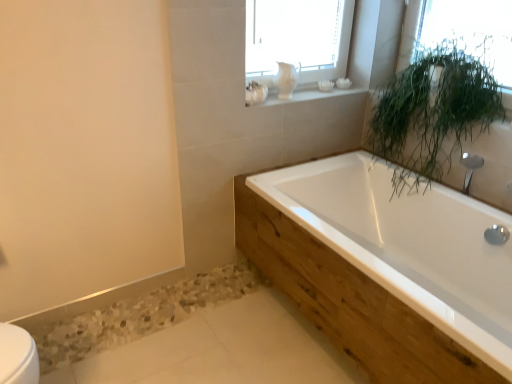
Question: Is green leafy plant at upper right facing towards green leafy plant at upper right?

Choices:
 (A) yes
 (B) no

Answer: (A)

Question: Is green leafy plant at upper right at the right side of green leafy plant at upper right?

Choices:
 (A) yes
 (B) no

Answer: (A)

Question: Can you confirm if green leafy plant at upper right is bigger than green leafy plant at upper right?

Choices:
 (A) yes
 (B) no

Answer: (B)

Question: From the image's perspective, does green leafy plant at upper right appear lower than green leafy plant at upper right?

Choices:
 (A) yes
 (B) no

Answer: (B)

Question: From the image's perspective, does green leafy plant at upper right appear higher than green leafy plant at upper right?

Choices:
 (A) yes
 (B) no

Answer: (A)

Question: Considering the relative sizes of green leafy plant at upper right and green leafy plant at upper right in the image provided, is green leafy plant at upper right smaller than green leafy plant at upper right?

Choices:
 (A) no
 (B) yes

Answer: (B)

Question: From a real-world perspective, is green leafy plant at upper right below green leafy plant at upper right?

Choices:
 (A) yes
 (B) no

Answer: (A)

Question: Is green leafy plant at upper right far away from green leafy plant at upper right?

Choices:
 (A) no
 (B) yes

Answer: (A)

Question: Considering the relative sizes of green leafy plant at upper right and green leafy plant at upper right in the image provided, is green leafy plant at upper right bigger than green leafy plant at upper right?

Choices:
 (A) no
 (B) yes

Answer: (B)

Question: Does green leafy plant at upper right have a lesser height compared to green leafy plant at upper right?

Choices:
 (A) no
 (B) yes

Answer: (A)

Question: Can we say green leafy plant at upper right lies outside green leafy plant at upper right?

Choices:
 (A) no
 (B) yes

Answer: (B)

Question: Considering the relative sizes of green leafy plant at upper right and green leafy plant at upper right in the image provided, is green leafy plant at upper right smaller than green leafy plant at upper right?

Choices:
 (A) no
 (B) yes

Answer: (A)

Question: Is white ceramic objects at upper center taller than green leafy plant at upper right?

Choices:
 (A) yes
 (B) no

Answer: (B)